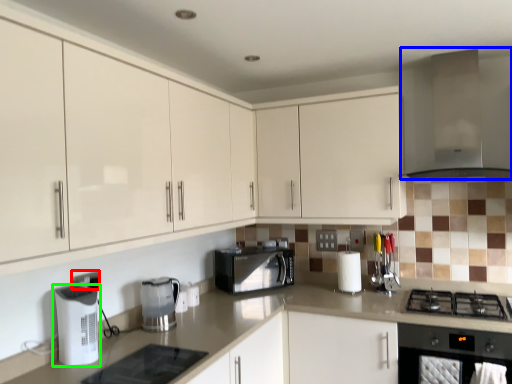
Question: Which object is the farthest from electric outlet (highlighted by a red box)? Choose among these: exhaust hood (highlighted by a blue box) or kitchen appliance (highlighted by a green box).

Choices:
 (A) exhaust hood
 (B) kitchen appliance

Answer: (A)